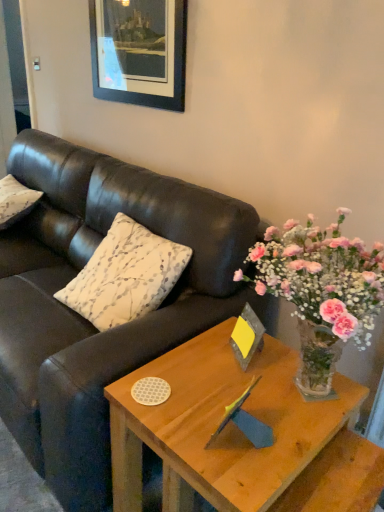
Question: From a real-world perspective, is wooden picture frame at upper center, the 1th picture frame in the back-to-front sequence, positioned above or below wooden block with yellow card at center, the first picture frame in the front-to-back sequence?

Choices:
 (A) below
 (B) above

Answer: (B)

Question: From their relative heights in the image, would you say wooden picture frame at upper center, which is counted as the 1th picture frame, starting from the left, is taller or shorter than wooden block with yellow card at center, marked as the second picture frame in a back-to-front arrangement?

Choices:
 (A) short
 (B) tall

Answer: (B)

Question: Which of these objects is positioned farthest from the light brown wood coffee table at center?

Choices:
 (A) white printed cushion at upper left, placed as the second pillow when sorted from back to front
 (B) wooden picture frame at upper center, which appears as the second picture frame when ordered from the bottom
 (C) matte black couch at center
 (D) wooden block with yellow card at center, positioned as the first picture frame in bottom-to-top order
 (E) white textured pillow at left, positioned as the first pillow in left-to-right order

Answer: (E)

Question: Which object is positioned closest to the white textured pillow at left, positioned as the first pillow in left-to-right order?

Choices:
 (A) light brown wood coffee table at center
 (B) matte black couch at center
 (C) wooden picture frame at upper center, the 2th picture frame viewed from the right
 (D) wooden block with yellow card at center, placed as the 2th picture frame when sorted from top to bottom
 (E) white printed cushion at upper left, the 1th pillow viewed from the right

Answer: (B)